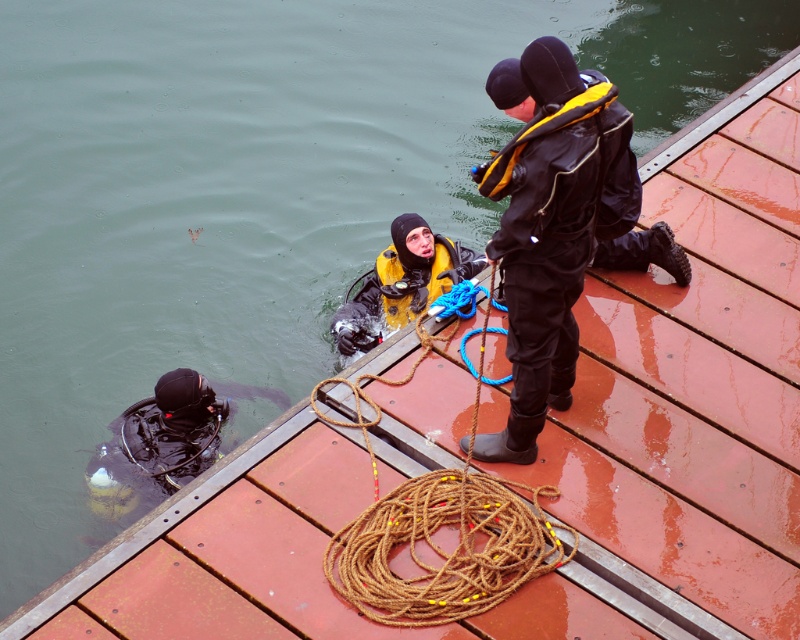
Between black matte wetsuit at upper right and yellow matte diving suit at center, which one appears on the left side from the viewer's perspective?

yellow matte diving suit at center is more to the left.

Between point (532, 138) and point (406, 268), which one is positioned behind?

Positioned behind is point (406, 268).

This screenshot has height=640, width=800. What do you see at coordinates (560, 230) in the screenshot?
I see `black matte wetsuit at upper right` at bounding box center [560, 230].

You are a GUI agent. You are given a task and a screenshot of the screen. Output one action in this format:
    pyautogui.click(x=<x>, y=<y>)
    Task: Click on the black matte wetsuit at upper right
    The width and height of the screenshot is (800, 640).
    Given the screenshot: What is the action you would take?
    pyautogui.click(x=560, y=230)

Does brown rough rope at center have a lesser height compared to yellow matte diving suit at center?

No, brown rough rope at center is not shorter than yellow matte diving suit at center.

Is brown rough rope at center closer to camera compared to yellow matte diving suit at center?

Yes, it is.

Image resolution: width=800 pixels, height=640 pixels. In order to click on brown rough rope at center in this screenshot , I will do `click(437, 531)`.

Describe the element at coordinates (437, 531) in the screenshot. Image resolution: width=800 pixels, height=640 pixels. I see `brown rough rope at center` at that location.

Where is `brown rough rope at center`? Image resolution: width=800 pixels, height=640 pixels. brown rough rope at center is located at coordinates (437, 531).

Describe the element at coordinates (437, 531) in the screenshot. I see `brown rough rope at center` at that location.

The width and height of the screenshot is (800, 640). I want to click on brown rough rope at center, so click(x=437, y=531).